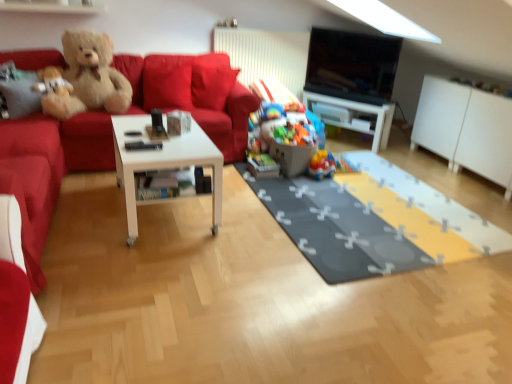
Question: Looking at the image, does plastic colorful toys at center, arranged as the second toy when viewed from the left, seem bigger or smaller compared to velvet red couch at left?

Choices:
 (A) small
 (B) big

Answer: (A)

Question: Do you think plastic colorful toys at center, arranged as the second toy when viewed from the left, is within velvet red couch at left, or outside of it?

Choices:
 (A) inside
 (B) outside

Answer: (B)

Question: Which of these objects is positioned closest to the white glossy table at center?

Choices:
 (A) white matte cabinet at right
 (B) black glossy tv at upper center
 (C) plastic colorful toys at center, arranged as the second toy when viewed from the left
 (D) white glossy coffee table at center
 (E) gray fabric mat at center

Answer: (B)

Question: Based on their relative distances, which object is nearer to the white glossy table at center?

Choices:
 (A) plastic colorful toys at center, arranged as the second toy when viewed from the left
 (B) white glossy coffee table at center
 (C) velvet red couch at left
 (D) matte red couch at left
 (E) fluffy beige teddy bear at upper left, which is counted as the second teddy bear, starting from the right

Answer: (A)